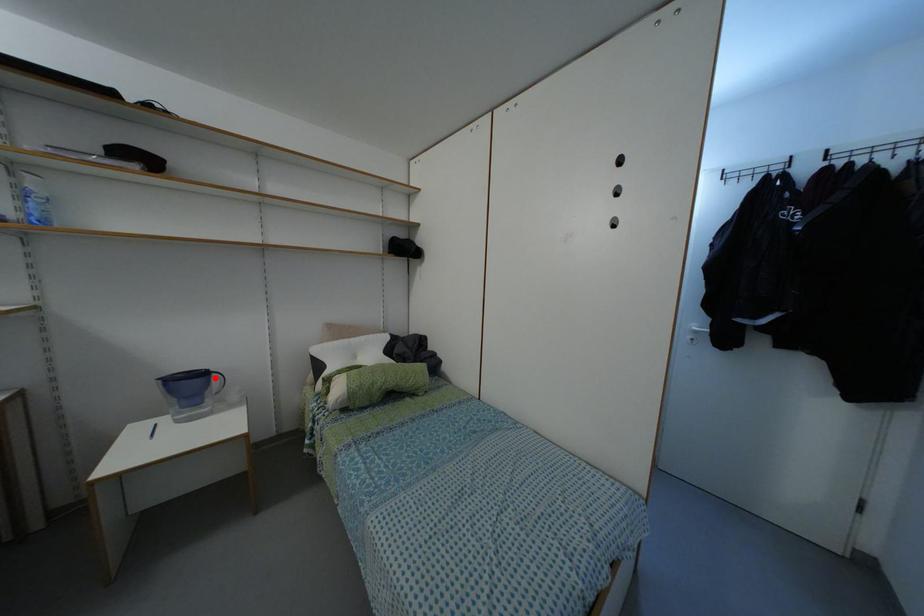
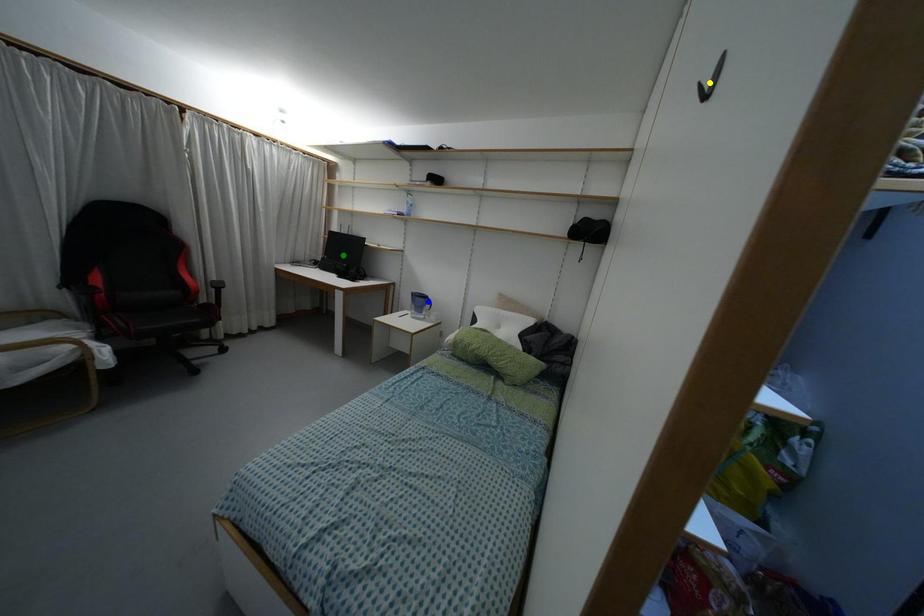
Question: I am providing you with two images of the same scene from different viewpoints. A red point is marked on the first image. You are given multiple points on the second image. In image 2, which mark is for the same physical point as the one in image 1?

Choices:
 (A) blue point
 (B) yellow point
 (C) green point

Answer: (A)